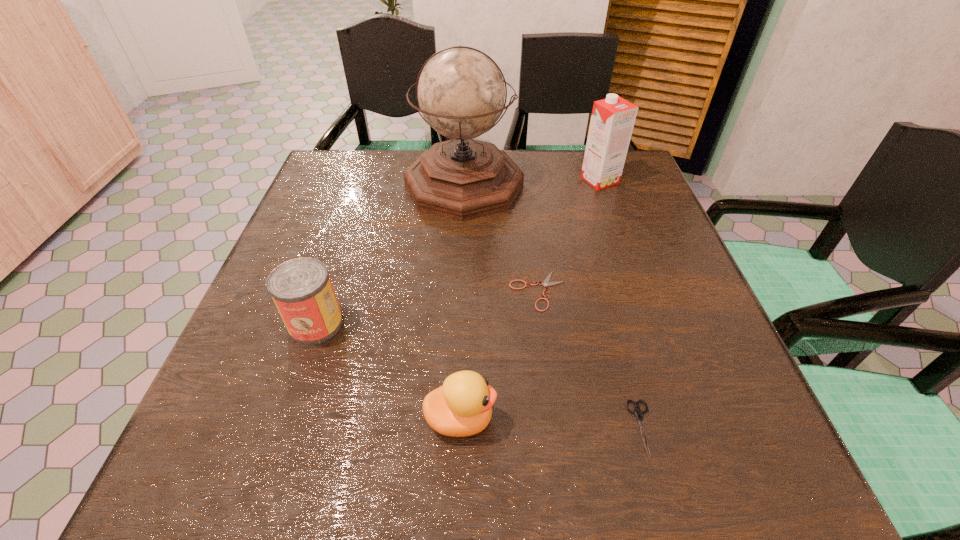
The image size is (960, 540). I want to click on object that is at the right edge, so click(612, 120).

The image size is (960, 540). In order to click on object that is at the far right corner in this screenshot , I will do `click(612, 120)`.

Identify the location of free space at the far edge of the desktop. The height and width of the screenshot is (540, 960). (561, 193).

The width and height of the screenshot is (960, 540). Find the location of `vacant space at the near edge of the desktop`. vacant space at the near edge of the desktop is located at coordinates (624, 452).

Image resolution: width=960 pixels, height=540 pixels. In the image, there is a desktop. Find the location of `free region at the left edge`. free region at the left edge is located at coordinates (352, 235).

You are a GUI agent. You are given a task and a screenshot of the screen. Output one action in this format:
    pyautogui.click(x=<x>, y=<y>)
    Task: Click on the free region at the right edge of the desktop
    
    Given the screenshot: What is the action you would take?
    pyautogui.click(x=647, y=221)

In order to click on vacant point located between the fifth shortest object and the globe in this screenshot , I will do click(532, 183).

Locate an element on the screen. Image resolution: width=960 pixels, height=540 pixels. vacant space that's between the taller shears and the globe is located at coordinates (553, 307).

In order to click on empty location between the right shears and the farther shears in this screenshot , I will do `click(590, 360)`.

Find the location of a particular element. The height and width of the screenshot is (540, 960). vacant space that's between the leftmost object and the duckling is located at coordinates (388, 372).